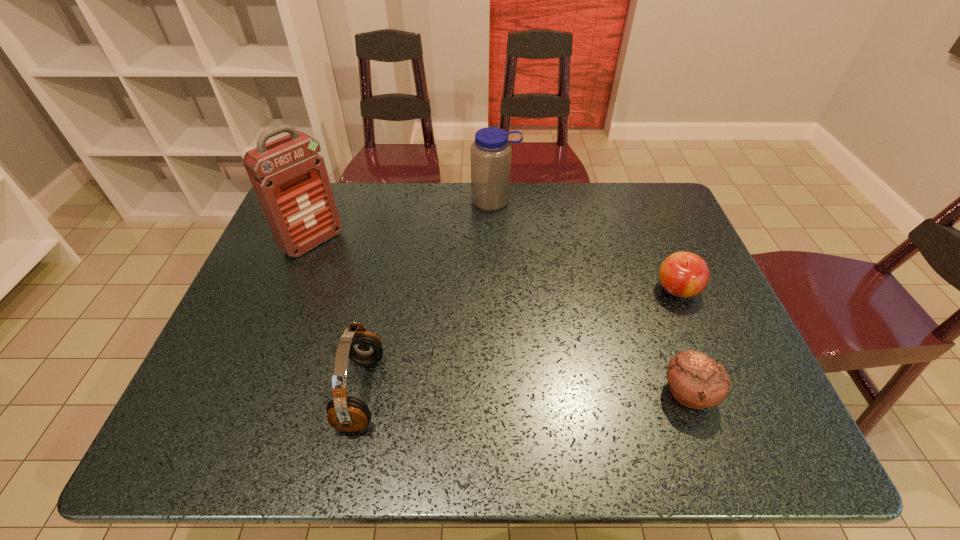
Find the location of `vacant space on the desktop that is between the third shortest object and the muffin and is positioned on the stem of the apple`. vacant space on the desktop that is between the third shortest object and the muffin and is positioned on the stem of the apple is located at coordinates (478, 393).

Where is `vacant space on the desktop that is between the headset and the muffin and is positioned on the front-facing side of the second farthest object`? The image size is (960, 540). vacant space on the desktop that is between the headset and the muffin and is positioned on the front-facing side of the second farthest object is located at coordinates (503, 393).

Where is `free space on the desktop that is between the third tallest object and the muffin and is positioned with a carrying loop on the side of the farthest object`? free space on the desktop that is between the third tallest object and the muffin and is positioned with a carrying loop on the side of the farthest object is located at coordinates (503, 393).